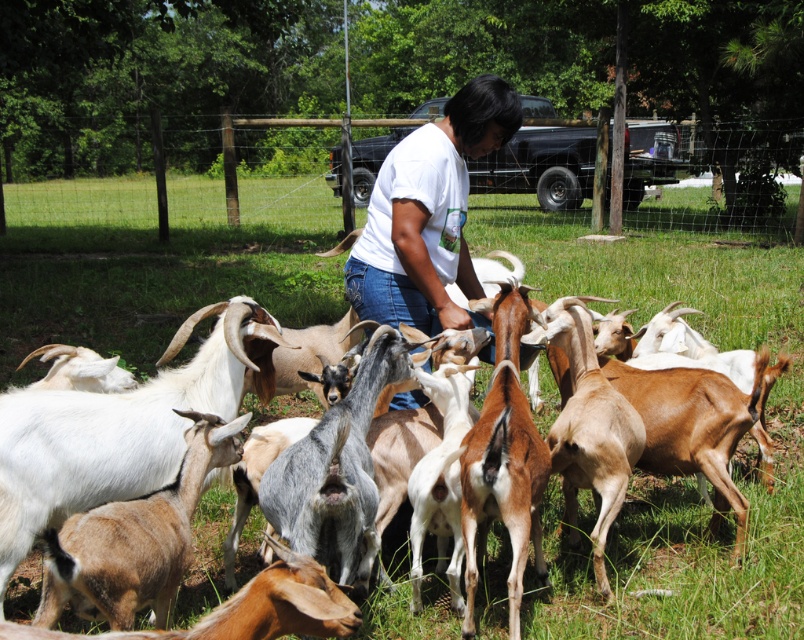
Who is more forward, (725, 268) or (480, 106)?

Positioned in front is point (480, 106).

Does point (757, 563) come behind point (446, 122)?

Yes.

What do you see at coordinates (671, 477) in the screenshot? I see `green grass at center` at bounding box center [671, 477].

Find the location of a particular element. Image resolution: width=804 pixels, height=640 pixels. green grass at center is located at coordinates (671, 477).